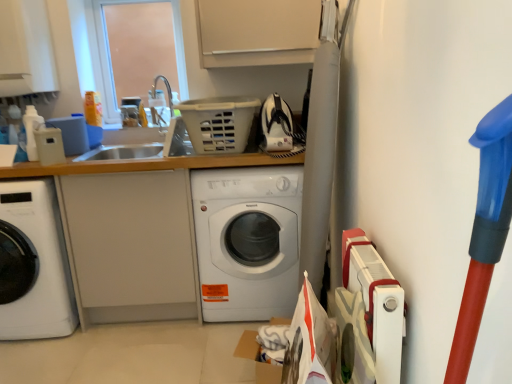
What do you see at coordinates (247, 241) in the screenshot? I see `white glossy washing machine at center, which ranks as the 2th washing machine in left-to-right order` at bounding box center [247, 241].

What are the coordinates of `transparent plastic window screen at upper left` in the screenshot? It's located at pyautogui.click(x=110, y=53).

Where is `white matte counter top at center`? The width and height of the screenshot is (512, 384). white matte counter top at center is located at coordinates (134, 232).

In the scene shown: Is white glossy washing machine at center, marked as the 1th washing machine in a right-to-left arrangement, at the back of white matte counter top at center?

Yes, white matte counter top at center is facing away from white glossy washing machine at center, marked as the 1th washing machine in a right-to-left arrangement.

Which object is positioned more to the left, white matte counter top at center or white glossy washing machine at center, marked as the 1th washing machine in a right-to-left arrangement?

white matte counter top at center is more to the left.

Is white glossy washing machine at center, which ranks as the 2th washing machine in left-to-right order, inside white matte counter top at center?

Yes, white glossy washing machine at center, which ranks as the 2th washing machine in left-to-right order, can be found within white matte counter top at center.

Considering the sizes of objects white glossy washing machine at center, which ranks as the 2th washing machine in left-to-right order, and transparent plastic window screen at upper left in the image provided, who is wider, white glossy washing machine at center, which ranks as the 2th washing machine in left-to-right order, or transparent plastic window screen at upper left?

Wider between the two is white glossy washing machine at center, which ranks as the 2th washing machine in left-to-right order.

Is white glossy washing machine at center, which ranks as the 2th washing machine in left-to-right order, smaller than transparent plastic window screen at upper left?

No, white glossy washing machine at center, which ranks as the 2th washing machine in left-to-right order, is not smaller than transparent plastic window screen at upper left.

How many degrees apart are the facing directions of white glossy washing machine at center, which ranks as the 2th washing machine in left-to-right order, and transparent plastic window screen at upper left?

0.985 degrees.

From the image's perspective, between white glossy washing machine at center, marked as the 1th washing machine in a right-to-left arrangement, and transparent plastic window screen at upper left, who is located below?

From the image's view, white glossy washing machine at center, marked as the 1th washing machine in a right-to-left arrangement, is below.

From the image's perspective, between white glossy washing machine at left, which appears as the first washing machine when viewed from the left, and white glossy washing machine at center, which ranks as the 2th washing machine in left-to-right order, which one is located above?

white glossy washing machine at center, which ranks as the 2th washing machine in left-to-right order, from the image's perspective.

You are a GUI agent. You are given a task and a screenshot of the screen. Output one action in this format:
    pyautogui.click(x=<x>, y=<y>)
    Task: Click on the washing machine on the right of white glossy washing machine at left, which appears as the first washing machine when viewed from the left
    The image size is (512, 384).
    Given the screenshot: What is the action you would take?
    pyautogui.click(x=247, y=241)

Is white glossy washing machine at left, which appears as the first washing machine when viewed from the left, closer to camera compared to white glossy washing machine at center, marked as the 1th washing machine in a right-to-left arrangement?

Yes, it is in front of white glossy washing machine at center, marked as the 1th washing machine in a right-to-left arrangement.

Who is bigger, white glossy washing machine at left, acting as the second washing machine starting from the right, or white glossy washing machine at center, which ranks as the 2th washing machine in left-to-right order?

white glossy washing machine at left, acting as the second washing machine starting from the right.

Who is shorter, white glossy washing machine at center, which ranks as the 2th washing machine in left-to-right order, or white matte counter top at center?

Standing shorter between the two is white glossy washing machine at center, which ranks as the 2th washing machine in left-to-right order.

Is white matte counter top at center at the back of white glossy washing machine at center, marked as the 1th washing machine in a right-to-left arrangement?

Yes.

From a real-world perspective, which is physically below, white glossy washing machine at center, marked as the 1th washing machine in a right-to-left arrangement, or white matte counter top at center?

In real-world perspective, white glossy washing machine at center, marked as the 1th washing machine in a right-to-left arrangement, is lower.

From the picture: Can you see white glossy washing machine at center, which ranks as the 2th washing machine in left-to-right order, touching white matte counter top at center?

white glossy washing machine at center, which ranks as the 2th washing machine in left-to-right order, and white matte counter top at center are not in contact.

Find the location of a particular element. window screen on the right of the white glossy washing machine at left, which appears as the first washing machine when viewed from the left is located at coordinates (110, 53).

Considering the positions of objects transparent plastic window screen at upper left and white glossy washing machine at left, acting as the second washing machine starting from the right, in the image provided, who is more to the right, transparent plastic window screen at upper left or white glossy washing machine at left, acting as the second washing machine starting from the right,?

From the viewer's perspective, transparent plastic window screen at upper left appears more on the right side.

Can you confirm if transparent plastic window screen at upper left is thinner than white glossy washing machine at left, acting as the second washing machine starting from the right?

Indeed, transparent plastic window screen at upper left has a lesser width compared to white glossy washing machine at left, acting as the second washing machine starting from the right.

Which point is more distant from viewer, (115,93) or (23,322)?

Positioned behind is point (115,93).

Consider the image. Is white matte counter top at center oriented towards white glossy washing machine at left, acting as the second washing machine starting from the right?

Yes, white matte counter top at center faces towards white glossy washing machine at left, acting as the second washing machine starting from the right.

Does white matte counter top at center have a greater height compared to white glossy washing machine at left, which appears as the first washing machine when viewed from the left?

Yes.

Which of these two, white matte counter top at center or white glossy washing machine at left, which appears as the first washing machine when viewed from the left, is wider?

Wider between the two is white glossy washing machine at left, which appears as the first washing machine when viewed from the left.

Which is closer to the camera, (78, 215) or (31, 283)?

Point (78, 215) appears to be farther away from the viewer than point (31, 283).

Could you tell me if white matte counter top at center is turned towards transparent plastic window screen at upper left?

No, white matte counter top at center is not oriented towards transparent plastic window screen at upper left.

From a real-world perspective, is white matte counter top at center under transparent plastic window screen at upper left?

Correct, in the physical world, white matte counter top at center is lower than transparent plastic window screen at upper left.

From the picture: In the image, is white matte counter top at center on the left side or the right side of transparent plastic window screen at upper left?

white matte counter top at center is positioned on transparent plastic window screen at upper left's right side.

From the image's perspective, is white matte counter top at center above or below transparent plastic window screen at upper left?

white matte counter top at center is below transparent plastic window screen at upper left.

You are a GUI agent. You are given a task and a screenshot of the screen. Output one action in this format:
    pyautogui.click(x=<x>, y=<y>)
    Task: Click on the counter top on the left of the white glossy washing machine at center, marked as the 1th washing machine in a right-to-left arrangement
    
    Given the screenshot: What is the action you would take?
    pyautogui.click(x=134, y=232)

There is a transparent plastic window screen at upper left. In order to click on the 1st washing machine below it (from the image's perspective) in this screenshot , I will do `click(247, 241)`.

Which object lies further to the anchor point white matte counter top at center, white glossy washing machine at center, marked as the 1th washing machine in a right-to-left arrangement, or transparent plastic window screen at upper left?

transparent plastic window screen at upper left lies further to white matte counter top at center than the other object.

Looking at the image, which one is located closer to white matte counter top at center, transparent plastic window screen at upper left or white glossy washing machine at center, marked as the 1th washing machine in a right-to-left arrangement?

white glossy washing machine at center, marked as the 1th washing machine in a right-to-left arrangement, is positioned closer to the anchor white matte counter top at center.

Based on the photo, when comparing their distances from white glossy washing machine at center, which ranks as the 2th washing machine in left-to-right order, does transparent plastic window screen at upper left or white glossy washing machine at left, which appears as the first washing machine when viewed from the left, seem closer?

Among the two, white glossy washing machine at left, which appears as the first washing machine when viewed from the left, is located nearer to white glossy washing machine at center, which ranks as the 2th washing machine in left-to-right order.

Looking at the image, which one is located closer to transparent plastic window screen at upper left, white glossy washing machine at left, which appears as the first washing machine when viewed from the left, or white glossy washing machine at center, marked as the 1th washing machine in a right-to-left arrangement?

white glossy washing machine at left, which appears as the first washing machine when viewed from the left, is positioned closer to the anchor transparent plastic window screen at upper left.

Which object lies further to the anchor point transparent plastic window screen at upper left, white glossy washing machine at center, marked as the 1th washing machine in a right-to-left arrangement, or white matte counter top at center?

white glossy washing machine at center, marked as the 1th washing machine in a right-to-left arrangement.

Which object lies nearer to the anchor point transparent plastic window screen at upper left, white glossy washing machine at center, which ranks as the 2th washing machine in left-to-right order, or white glossy washing machine at left, which appears as the first washing machine when viewed from the left?

white glossy washing machine at left, which appears as the first washing machine when viewed from the left, lies closer to transparent plastic window screen at upper left than the other object.

When comparing their distances from white glossy washing machine at left, which appears as the first washing machine when viewed from the left, does transparent plastic window screen at upper left or white matte counter top at center seem further?

transparent plastic window screen at upper left is further to white glossy washing machine at left, which appears as the first washing machine when viewed from the left.

Estimate the real-world distances between objects in this image. Which object is further from white glossy washing machine at left, which appears as the first washing machine when viewed from the left, white glossy washing machine at center, marked as the 1th washing machine in a right-to-left arrangement, or white matte counter top at center?

Based on the image, white glossy washing machine at center, marked as the 1th washing machine in a right-to-left arrangement, appears to be further to white glossy washing machine at left, which appears as the first washing machine when viewed from the left.

Identify the location of counter top situated between white glossy washing machine at left, which appears as the first washing machine when viewed from the left, and white glossy washing machine at center, which ranks as the 2th washing machine in left-to-right order, from left to right. Image resolution: width=512 pixels, height=384 pixels. (134, 232).

Find the location of `counter top between transparent plastic window screen at upper left and white glossy washing machine at center, which ranks as the 2th washing machine in left-to-right order, in the vertical direction`. counter top between transparent plastic window screen at upper left and white glossy washing machine at center, which ranks as the 2th washing machine in left-to-right order, in the vertical direction is located at coordinates (134, 232).

The height and width of the screenshot is (384, 512). Identify the location of counter top that lies between transparent plastic window screen at upper left and white glossy washing machine at left, which appears as the first washing machine when viewed from the left, from top to bottom. (134, 232).

Find the location of a particular element. The image size is (512, 384). window screen between white glossy washing machine at left, which appears as the first washing machine when viewed from the left, and white glossy washing machine at center, which ranks as the 2th washing machine in left-to-right order is located at coordinates (110, 53).